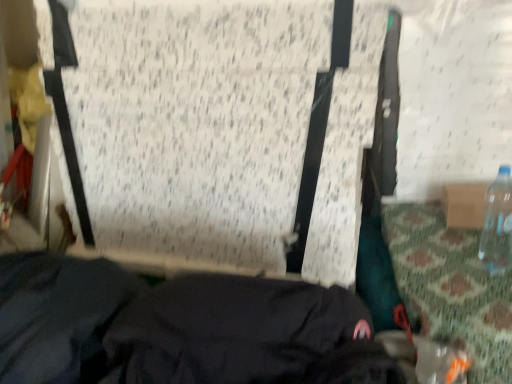
Image resolution: width=512 pixels, height=384 pixels. In order to click on free space to the back side of clear plastic bottle at right in this screenshot , I will do `click(450, 241)`.